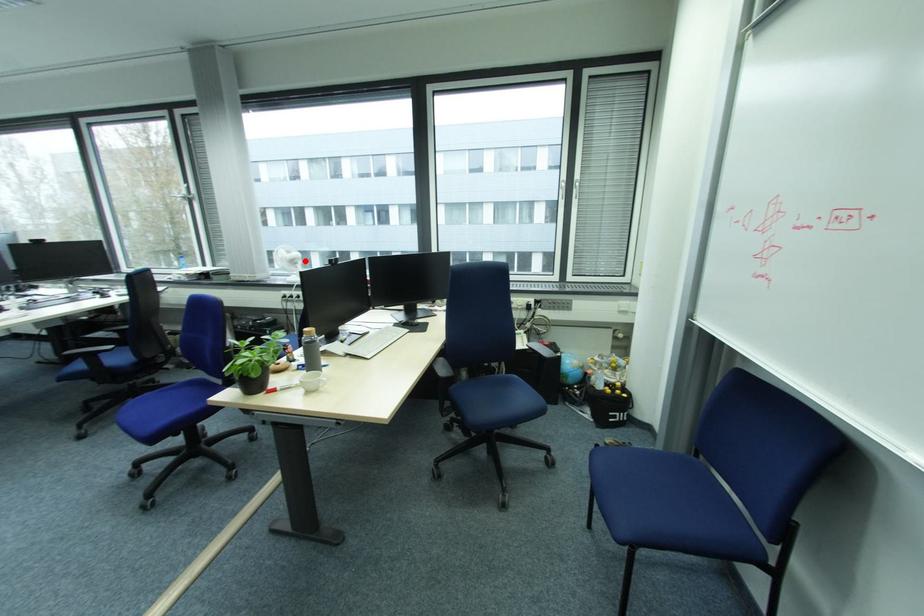
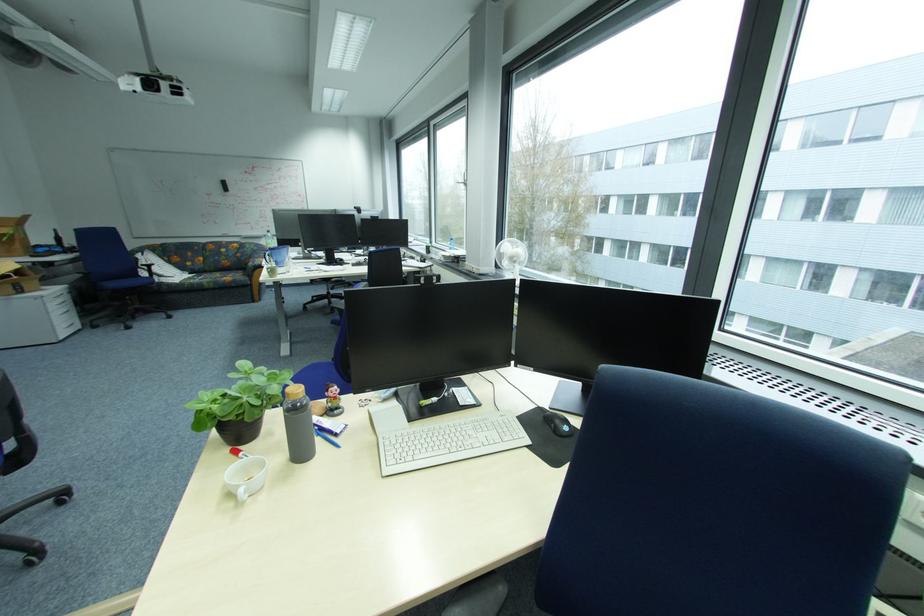
Question: A red point is marked in image1. In image2, is the corresponding 3D point closer to the camera or farther? Reply with the corresponding letter.

Choices:
 (A) The corresponding 3D point is closer.
 (B) The corresponding 3D point is farther.

Answer: (A)